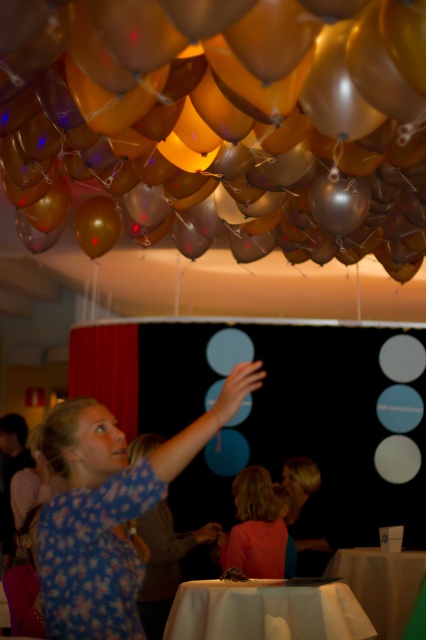
You are standing at the position of the young woman and want to reach both the point at coordinates point (x=359, y=550) and the point at coordinates point (x=275, y=563). Which point is closer to you?

Point (x=275, y=563) is closer to you because it is less further to the camera than point (x=359, y=550).

You are a guest at the event and want to place a gift on the table. Which table, the white cloth table at lower center or the smooth beige table at lower center, has a larger surface area to accommodate the gift?

The white cloth table at lower center might be wider than smooth beige table at lower center, so it likely has a larger surface area to accommodate the gift.